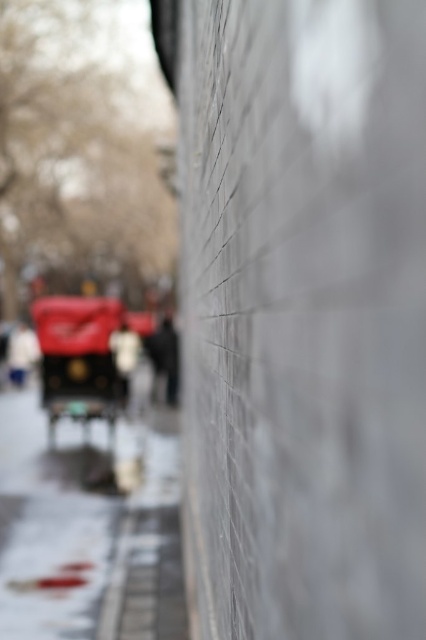
Does concrete pavement at lower left appear under white matte jacket at left?

Indeed, concrete pavement at lower left is positioned under white matte jacket at left.

Between concrete pavement at lower left and white matte jacket at left, which one is positioned lower?

concrete pavement at lower left is below.

The image size is (426, 640). Identify the location of concrete pavement at lower left. (88, 529).

Locate an element on the screen. The height and width of the screenshot is (640, 426). concrete pavement at lower left is located at coordinates (88, 529).

Between point (100, 380) and point (115, 355), which one is positioned in front?

Point (100, 380)

Between point (92, 323) and point (112, 352), which one is positioned behind?

The point (112, 352) is more distant.

The image size is (426, 640). I want to click on shiny red car at left, so click(81, 356).

You are a GUI agent. You are given a task and a screenshot of the screen. Output one action in this format:
    pyautogui.click(x=<x>, y=<y>)
    Task: Click on the shiny red car at left
    Image resolution: width=426 pixels, height=640 pixels.
    Given the screenshot: What is the action you would take?
    pyautogui.click(x=81, y=356)

Does concrete pavement at lower left appear on the right side of dark gray fabric jacket at center?

No, concrete pavement at lower left is not to the right of dark gray fabric jacket at center.

Is point (71, 570) positioned before point (157, 355)?

That is True.

Find the location of `concrete pavement at lower left`. concrete pavement at lower left is located at coordinates (88, 529).